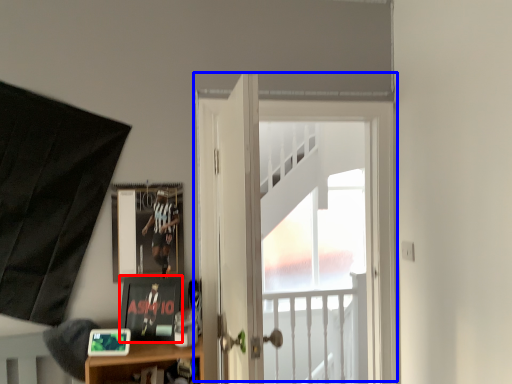
Question: Among these objects, which one is nearest to the camera, picture frame (highlighted by a red box) or door (highlighted by a blue box)?

Choices:
 (A) picture frame
 (B) door

Answer: (A)